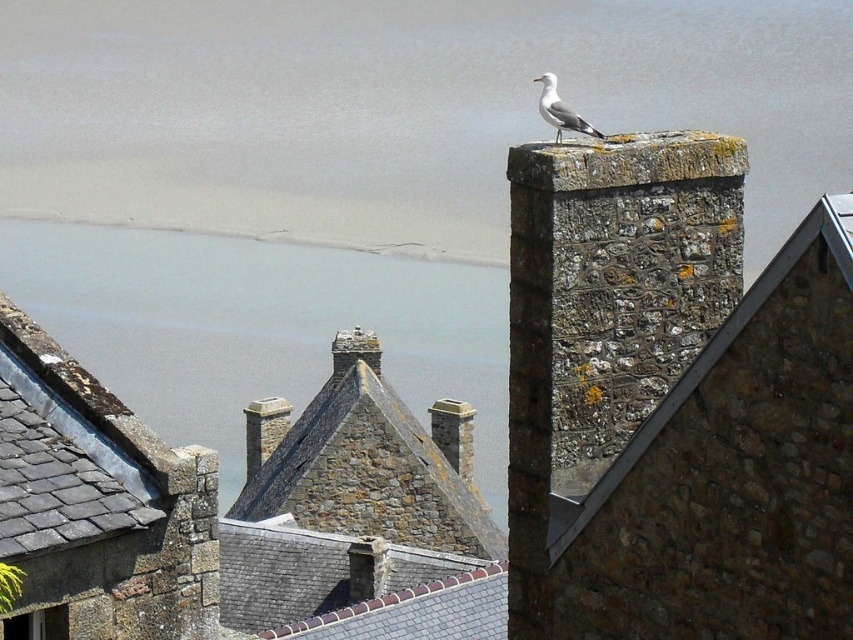
Can you confirm if gray stone water at upper center is positioned below white feathered bird at upper center?

Yes.

Can you confirm if gray stone water at upper center is positioned to the right of white feathered bird at upper center?

In fact, gray stone water at upper center is to the left of white feathered bird at upper center.

At what (x,y) coordinates should I click in order to perform the action: click on gray stone water at upper center. Please return your answer as a coordinate pair (x, y). Looking at the image, I should click on (258, 326).